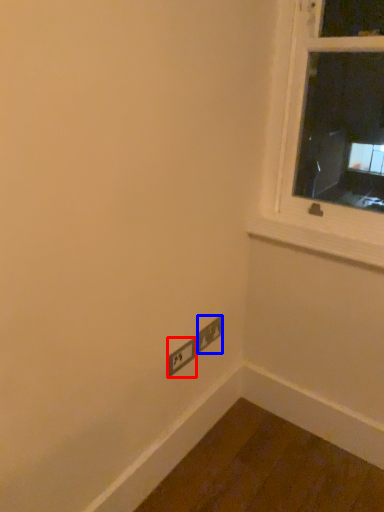
Question: Among these objects, which one is farthest to the camera, power plugs and sockets (highlighted by a red box) or power plugs and sockets (highlighted by a blue box)?

Choices:
 (A) power plugs and sockets
 (B) power plugs and sockets

Answer: (B)